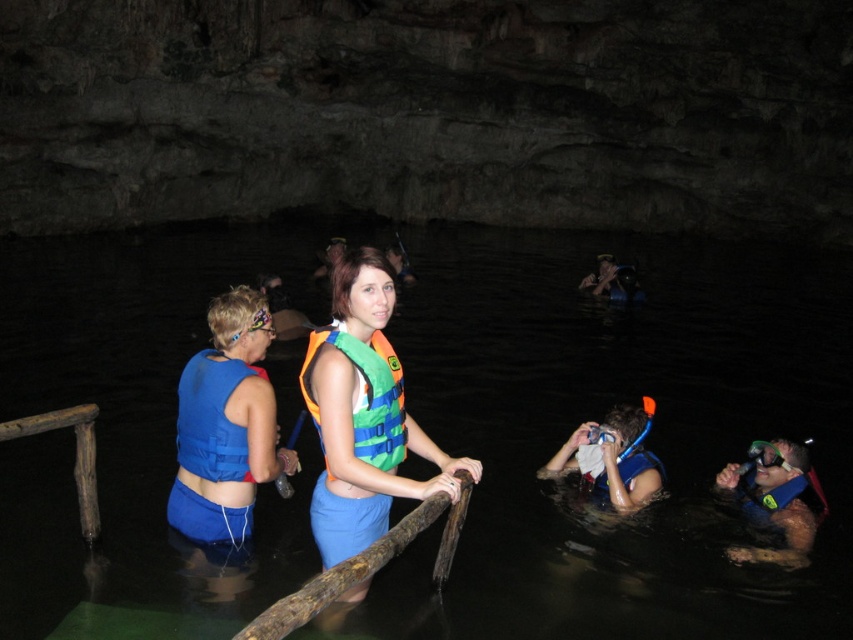
Question: Is neon green life jacket at center thinner than blue life vest at lower center?

Choices:
 (A) yes
 (B) no

Answer: (A)

Question: Which object is positioned farthest from the green/orange life vest at center?

Choices:
 (A) blue life vest at lower center
 (B) blue rubber snorkel at lower right

Answer: (B)

Question: Which point is closer to the camera?

Choices:
 (A) blue life vest at left
 (B) neon green life jacket at center
 (C) blue life vest at lower center
 (D) blue fabric life vest at center

Answer: (B)

Question: Based on their relative distances, which object is farther from the blue life vest at left?

Choices:
 (A) green/orange life vest at center
 (B) blue life vest at lower center

Answer: (B)

Question: Does neon green life jacket at center appear on the right side of blue rubber snorkel at lower right?

Choices:
 (A) yes
 (B) no

Answer: (B)

Question: Does blue rubber snorkel at lower right appear on the left side of blue life vest at lower center?

Choices:
 (A) no
 (B) yes

Answer: (A)